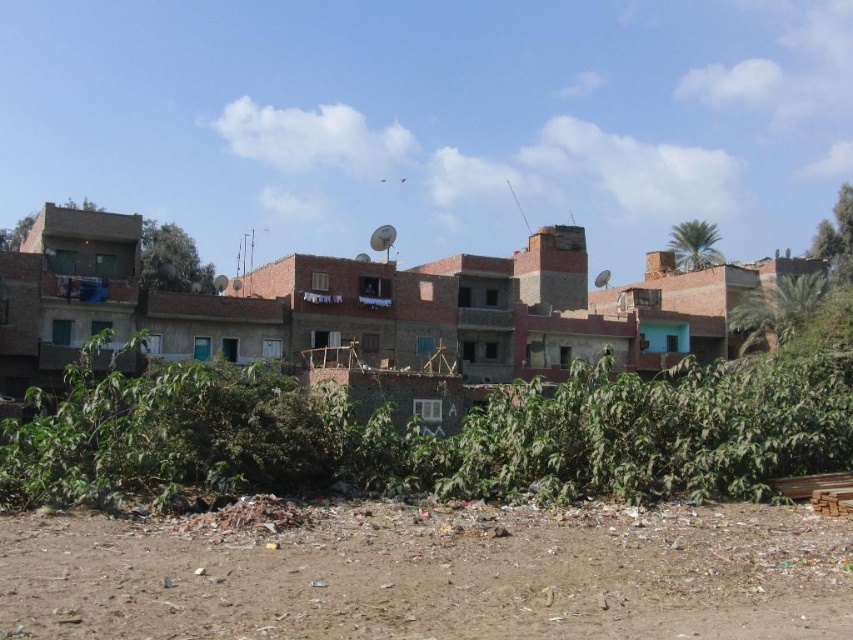
Which of these two, brown dirt field at lower center or green leafy plants at center, stands taller?

With more height is green leafy plants at center.

Is brown dirt field at lower center below green leafy plants at center?

Yes.

Does point (480, 616) lie behind point (312, 465)?

No, (480, 616) is in front of (312, 465).

The image size is (853, 640). Identify the location of brown dirt field at lower center. (434, 577).